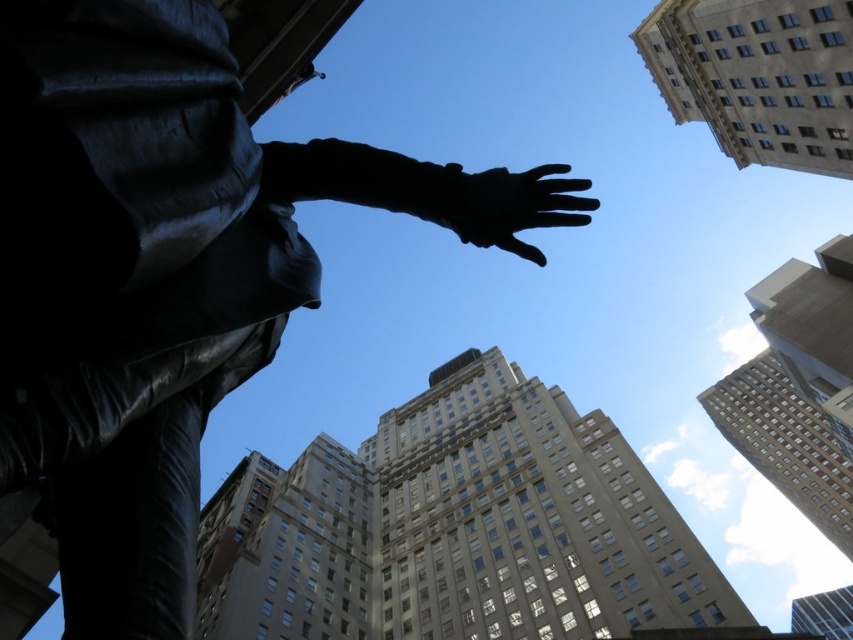
Which is behind, point (267, 211) or point (553, 198)?

Point (553, 198)

From the picture: Which of these two, black polished statue at center or black matte hand at upper center, stands shorter?

Standing shorter between the two is black matte hand at upper center.

Where is `black polished statue at center`? black polished statue at center is located at coordinates (144, 280).